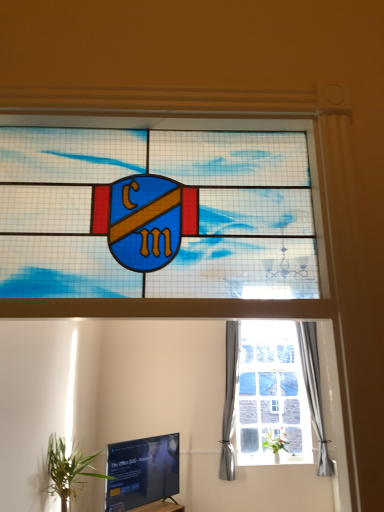
Question: Is black glossy tv at lower left behind gray fabric curtain at right, which appears as the 2th curtain when viewed from the right?

Choices:
 (A) no
 (B) yes

Answer: (A)

Question: Is black glossy tv at lower left aimed at gray fabric curtain at right, which appears as the 2th curtain when viewed from the right?

Choices:
 (A) no
 (B) yes

Answer: (A)

Question: Are black glossy tv at lower left and gray fabric curtain at right, which appears as the 2th curtain when viewed from the right, beside each other?

Choices:
 (A) yes
 (B) no

Answer: (B)

Question: From a real-world perspective, is black glossy tv at lower left located higher than gray fabric curtain at right, which ranks as the first curtain in left-to-right order?

Choices:
 (A) no
 (B) yes

Answer: (A)

Question: From the image's perspective, does black glossy tv at lower left appear higher than gray fabric curtain at right, which ranks as the first curtain in left-to-right order?

Choices:
 (A) yes
 (B) no

Answer: (B)

Question: From a real-world perspective, relative to silky gray curtain at right, arranged as the first curtain when viewed from the right, is stained glass shield at center vertically above or below?

Choices:
 (A) above
 (B) below

Answer: (A)

Question: Based on their positions, is stained glass shield at center located to the left or right of silky gray curtain at right, arranged as the first curtain when viewed from the right?

Choices:
 (A) left
 (B) right

Answer: (A)

Question: In the image, is stained glass shield at center positioned in front of or behind silky gray curtain at right, which is counted as the 2th curtain, starting from the left?

Choices:
 (A) front
 (B) behind

Answer: (A)

Question: Considering the positions of point (46, 253) and point (329, 474), is point (46, 253) closer or farther from the camera than point (329, 474)?

Choices:
 (A) farther
 (B) closer

Answer: (B)

Question: Is black glossy tv at lower left taller or shorter than green leafy plant at center, arranged as the 2th houseplant when viewed from the front?

Choices:
 (A) tall
 (B) short

Answer: (A)

Question: Based on their sizes in the image, would you say black glossy tv at lower left is bigger or smaller than green leafy plant at center, the first houseplant in the right-to-left sequence?

Choices:
 (A) big
 (B) small

Answer: (A)

Question: Does point (163, 451) appear closer or farther from the camera than point (263, 446)?

Choices:
 (A) farther
 (B) closer

Answer: (A)

Question: Considering the relative positions of black glossy tv at lower left and green leafy plant at center, which ranks as the first houseplant in back-to-front order, in the image provided, is black glossy tv at lower left to the left or to the right of green leafy plant at center, which ranks as the first houseplant in back-to-front order,?

Choices:
 (A) left
 (B) right

Answer: (A)

Question: Does point (56, 451) appear closer or farther from the camera than point (306, 347)?

Choices:
 (A) closer
 (B) farther

Answer: (B)

Question: Is green leafy plant at lower left, the second houseplant when ordered from back to front, to the left or to the right of silky gray curtain at right, which is counted as the 2th curtain, starting from the left, in the image?

Choices:
 (A) right
 (B) left

Answer: (B)